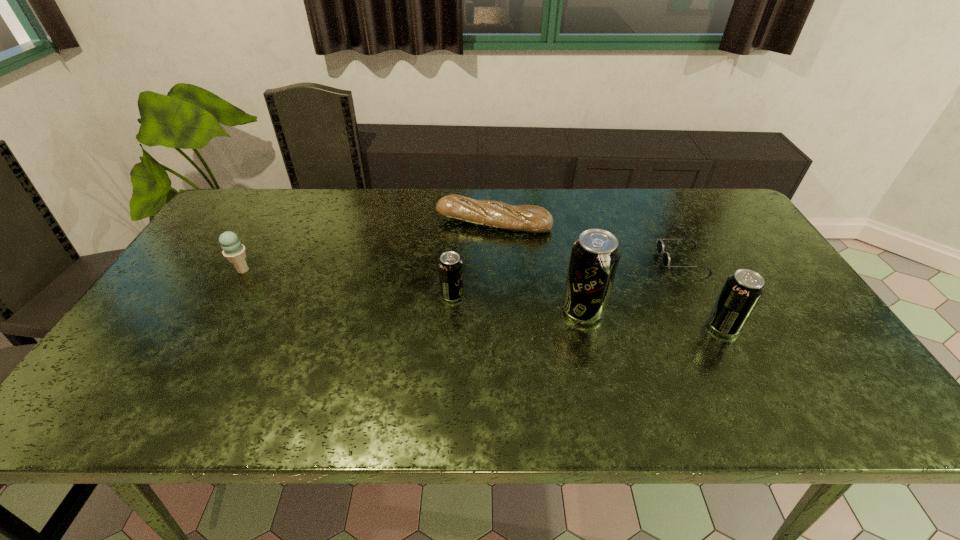
Where is `vacant position in the image that satisfies the following two spatial constraints: 1. on the front side of the second tallest object; 2. on the left side of the tallest soda can`? vacant position in the image that satisfies the following two spatial constraints: 1. on the front side of the second tallest object; 2. on the left side of the tallest soda can is located at coordinates (587, 326).